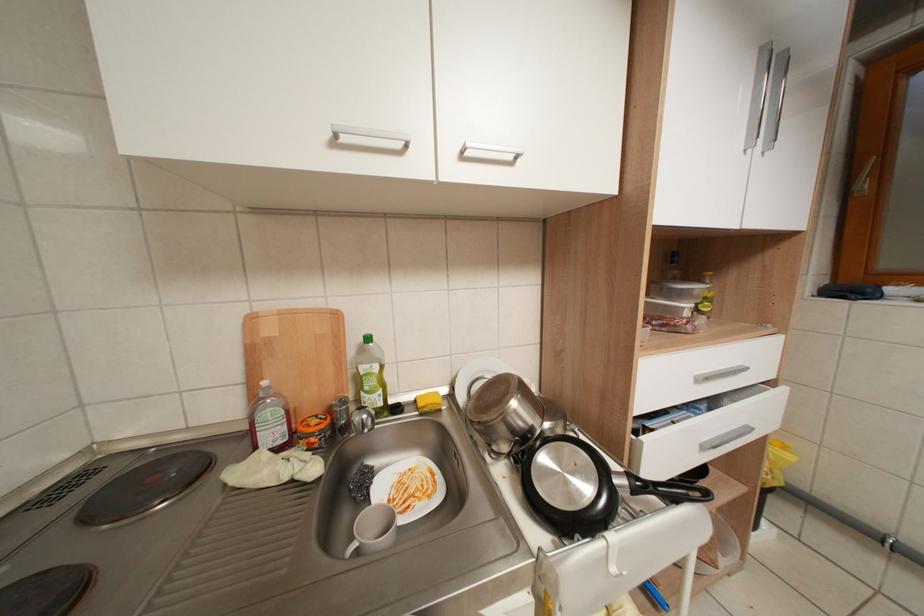
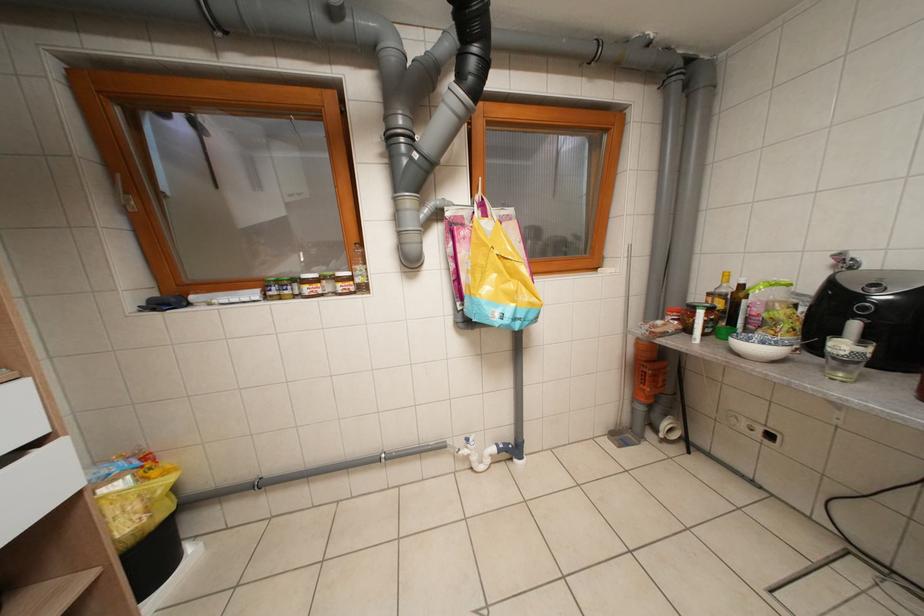
Question: The first image is from the beginning of the video and the second image is from the end. How did the camera likely rotate when shooting the video?

Choices:
 (A) Left
 (B) Right
 (C) Up
 (D) Down

Answer: (B)